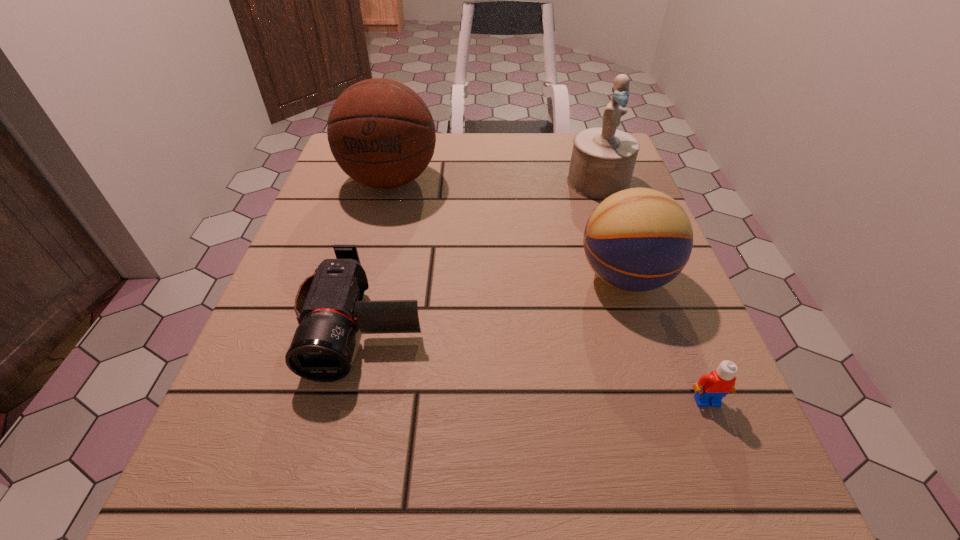
Locate an element on the screen. This screenshot has width=960, height=540. vacant space located 0.150m on the patterned surface of the third shortest object is located at coordinates pos(496,277).

At what (x,y) coordinates should I click in order to perform the action: click on vacant area situated on the patterned surface of the third shortest object. Please return your answer as a coordinate pair (x, y). Looking at the image, I should click on (544, 277).

Identify the location of vacant space situated on the lens of the camcorder. This screenshot has width=960, height=540. (340, 427).

At what (x,y) coordinates should I click in order to perform the action: click on free location located on the face of the Lego. Please return your answer as a coordinate pair (x, y). This screenshot has width=960, height=540. Looking at the image, I should click on (759, 531).

The width and height of the screenshot is (960, 540). What are the coordinates of `figurine positioned at the far edge` in the screenshot? It's located at (603, 158).

I want to click on basketball positioned at the far edge, so click(381, 133).

Identify the location of basketball that is positioned at the left edge. Image resolution: width=960 pixels, height=540 pixels. (381, 133).

Locate an element on the screen. This screenshot has width=960, height=540. camcorder at the left edge is located at coordinates (329, 308).

Identify the location of figurine that is at the right edge. This screenshot has height=540, width=960. (603, 158).

You are a GUI agent. You are given a task and a screenshot of the screen. Output one action in this format:
    pyautogui.click(x=<x>, y=<y>)
    Task: Click on the basketball situated at the right edge
    This screenshot has width=960, height=540.
    Given the screenshot: What is the action you would take?
    pyautogui.click(x=639, y=239)